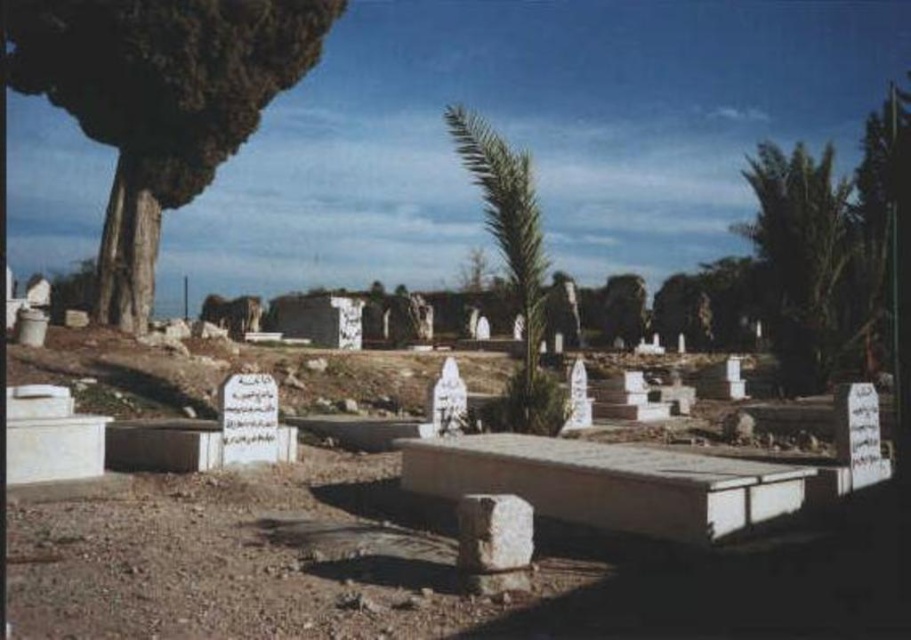
Which is in front, point (19, 74) or point (763, 211)?

Positioned in front is point (19, 74).

Which is above, green leafy tree at left or green leafy palm tree at upper right?

green leafy tree at left is higher up.

Is point (70, 22) more distant than point (751, 157)?

No.

At what (x,y) coordinates should I click in order to perform the action: click on green leafy tree at left. Please return your answer as a coordinate pair (x, y). Looking at the image, I should click on (159, 102).

Is the position of green leafy tree at left less distant than that of white stone gravestone at center?

No, green leafy tree at left is further to the viewer.

Image resolution: width=911 pixels, height=640 pixels. I want to click on green leafy tree at left, so click(x=159, y=102).

What do you see at coordinates (513, 259) in the screenshot? I see `green leafy palm at center` at bounding box center [513, 259].

Is point (553, 419) in front of point (517, 588)?

No, (553, 419) is further to viewer.

The height and width of the screenshot is (640, 911). I want to click on green leafy palm at center, so click(x=513, y=259).